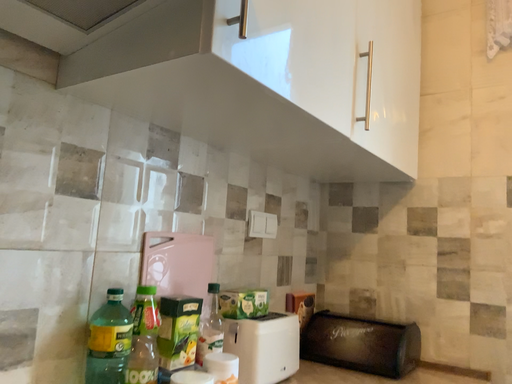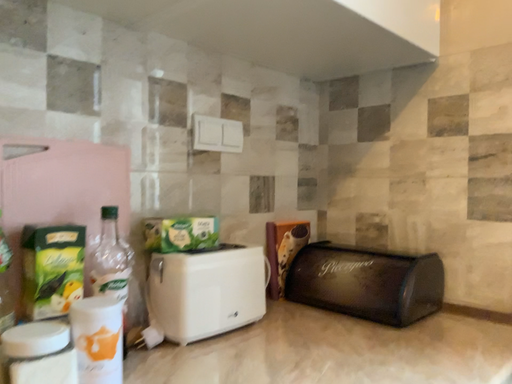
Question: Which way did the camera rotate in the video?

Choices:
 (A) rotated left
 (B) rotated right

Answer: (A)